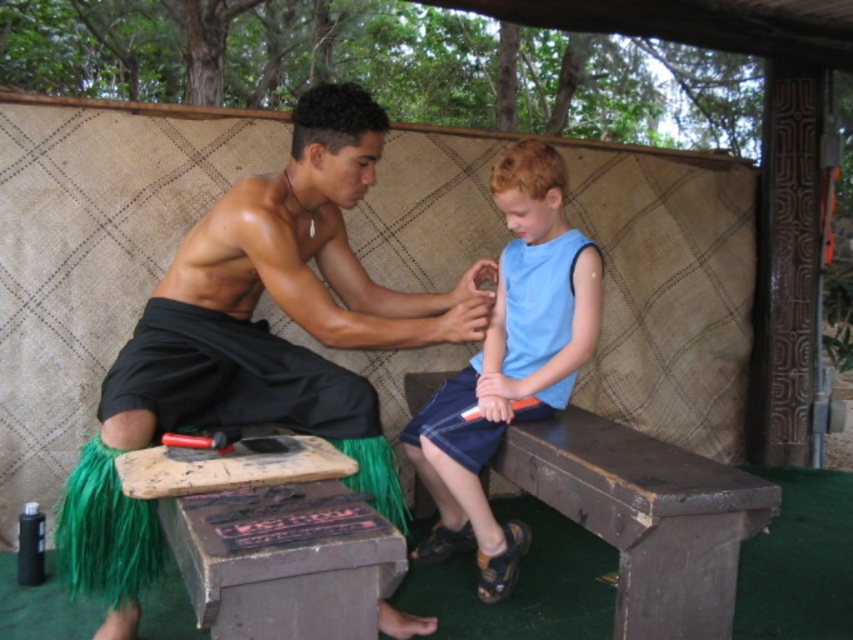
You are a photographer standing in front of the scene. You want to take a photo of the brown wooden bench at lower center and the black matte grass skirt at center. Which object should you focus on first if you want to capture both in the same frame without moving the camera?

The brown wooden bench at lower center should be focused on first because it is behind the black matte grass skirt at center, so focusing on the bench will ensure both objects are in focus if the depth of field is sufficient.

Looking at this image, you are a tailor measuring the distance between the black matte grass skirt at center and the brown wooden bench at lower center for a cultural performance. The minimum required space between the skirt and the bench for proper movement is 60 centimeters. Is the current distance sufficient?

The black matte grass skirt at center and the brown wooden bench at lower center are 72.45 centimeters apart, which exceeds the minimum required 60 centimeters, so the current distance is sufficient for proper movement.